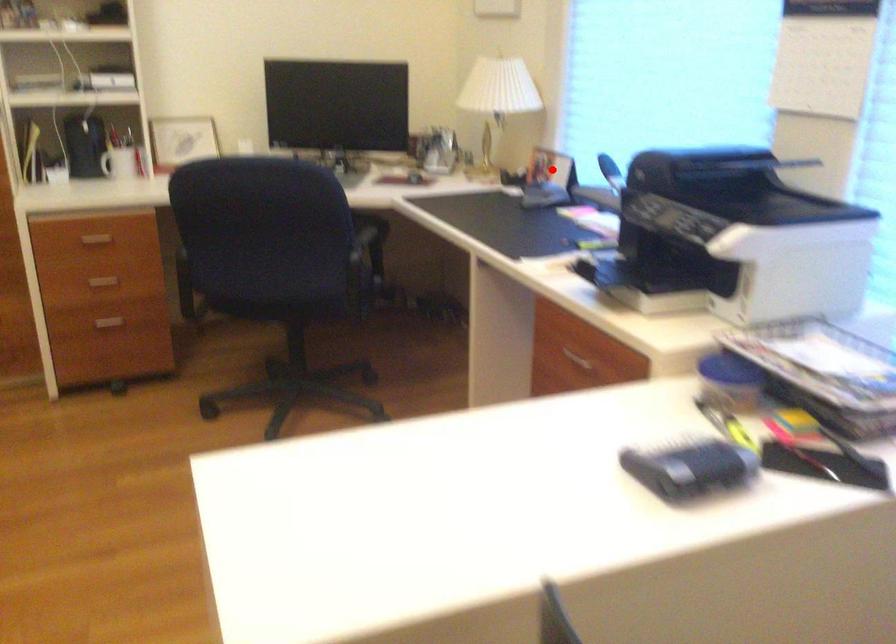
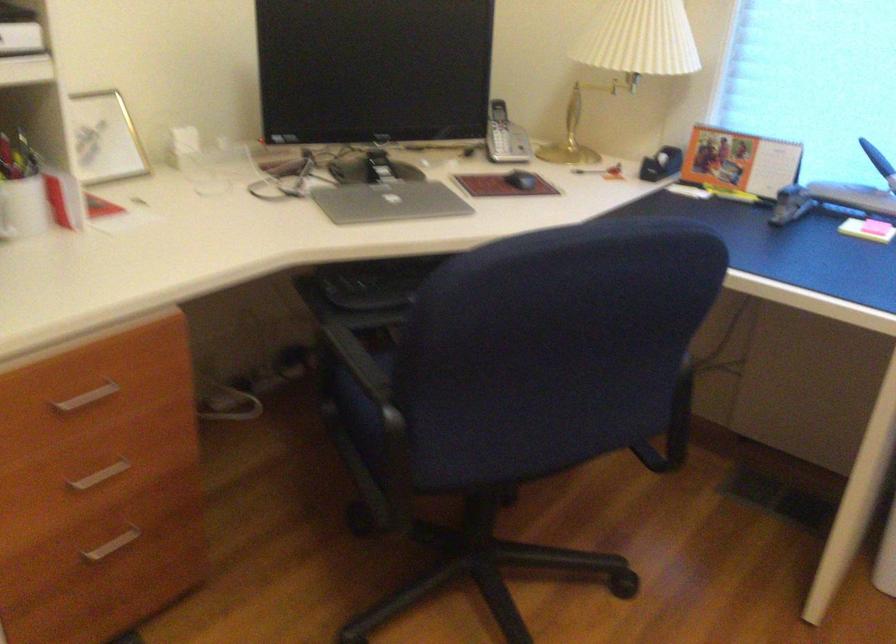
Find the pixel in the second image that matches the highlighted location in the first image.

(739, 162)